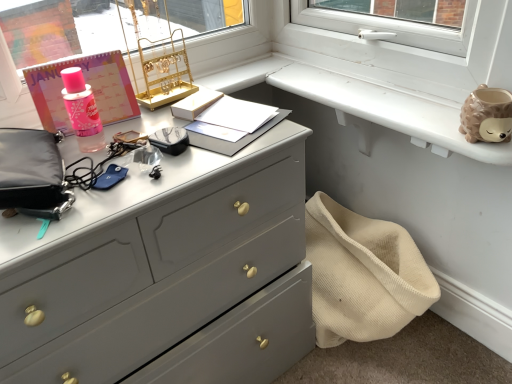
Where is `free space in front of gold metallic jewelry stand at upper center`? This screenshot has height=384, width=512. free space in front of gold metallic jewelry stand at upper center is located at coordinates (152, 115).